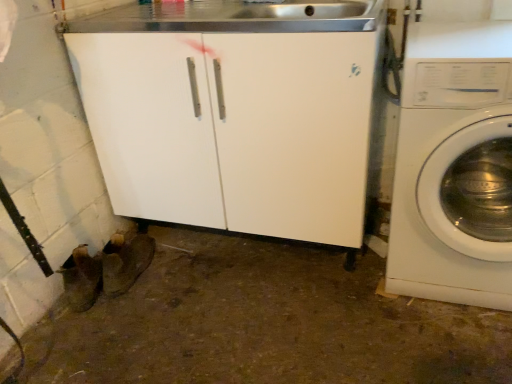
What do you see at coordinates (449, 162) in the screenshot?
I see `white glossy washing machine at right` at bounding box center [449, 162].

At what (x,y) coordinates should I click in order to perform the action: click on white glossy washing machine at right. Please return your answer as a coordinate pair (x, y). The width and height of the screenshot is (512, 384). Looking at the image, I should click on (449, 162).

Where is `white glossy washing machine at right`? white glossy washing machine at right is located at coordinates (449, 162).